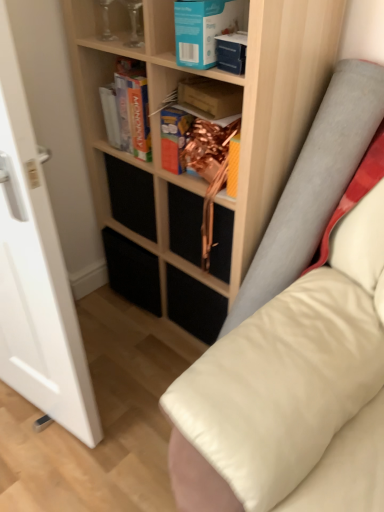
Question: In terms of size, does transparent glass door at left appear bigger or smaller than clear glass vase at upper left, positioned as the first shelf in left-to-right order?

Choices:
 (A) big
 (B) small

Answer: (A)

Question: Which is correct: transparent glass door at left is inside clear glass vase at upper left, positioned as the first shelf in left-to-right order, or outside of it?

Choices:
 (A) outside
 (B) inside

Answer: (A)

Question: Which is nearer to the clear glass vase at upper left, the 2th shelf from the right?

Choices:
 (A) wooden shelf at center, the 2th shelf from the left
 (B) matte cardboard box at upper center, the second paperback book when ordered from front to back
 (C) blue cardboard book at upper center, the 3th paperback book positioned from the back
 (D) matte cardboard book at center, which ranks as the third paperback book in front-to-back order
 (E) black matte drawer at lower center

Answer: (B)

Question: Based on their relative distances, which object is farther from the transparent glass door at left?

Choices:
 (A) wooden shelf at center, the first shelf in the right-to-left sequence
 (B) clear glass vase at upper left, positioned as the first shelf in left-to-right order
 (C) black matte drawer at lower center
 (D) matte cardboard book at center, which ranks as the third paperback book in front-to-back order
 (E) blue cardboard book at upper center, the 3th paperback book positioned from the back

Answer: (B)